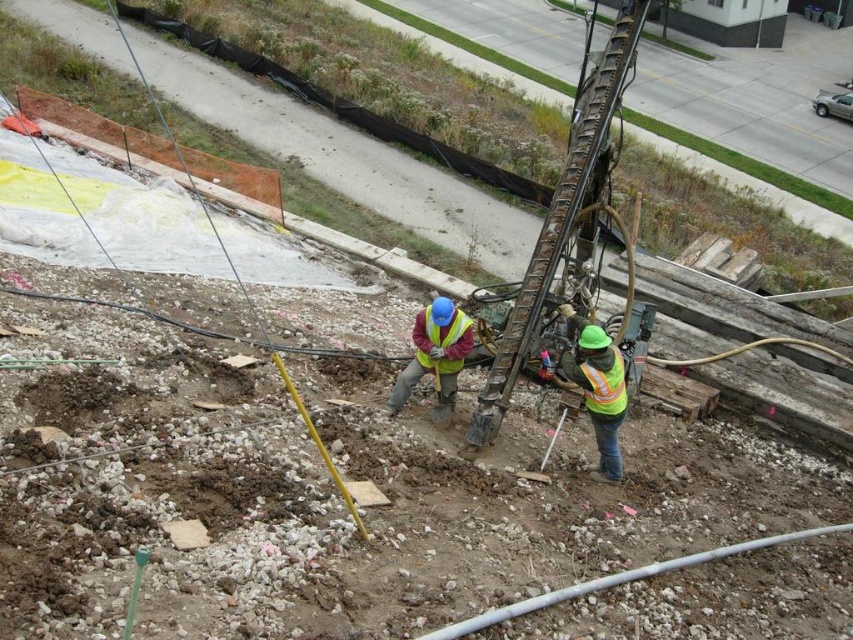
Does reflective yellow vest at center appear under reflective yellow safety vest at center?

Yes, reflective yellow vest at center is below reflective yellow safety vest at center.

Is point (389, 403) more distant than point (457, 339)?

That is True.

Between point (444, 312) and point (456, 356), which one is positioned in front?

Point (444, 312)

Find the location of a particular element. This screenshot has width=853, height=640. reflective yellow vest at center is located at coordinates (434, 355).

Can you confirm if metallic drill rig at center is wider than reflective yellow vest at center?

Yes.

Does metallic drill rig at center have a larger size compared to reflective yellow vest at center?

Correct, metallic drill rig at center is larger in size than reflective yellow vest at center.

At what (x,y) coordinates should I click in order to perform the action: click on metallic drill rig at center. Please return your answer as a coordinate pair (x, y). Looking at the image, I should click on (558, 220).

Can you confirm if reflective yellow vest at center is positioned below high-visibility reflective safety vest at lower right?

Incorrect, reflective yellow vest at center is not positioned below high-visibility reflective safety vest at lower right.

From the picture: Does reflective yellow vest at center come behind high-visibility reflective safety vest at lower right?

Yes.

Who is more forward, (398, 372) or (602, 380)?

Point (602, 380) is in front.

Locate an element on the screen. The height and width of the screenshot is (640, 853). reflective yellow vest at center is located at coordinates click(434, 355).